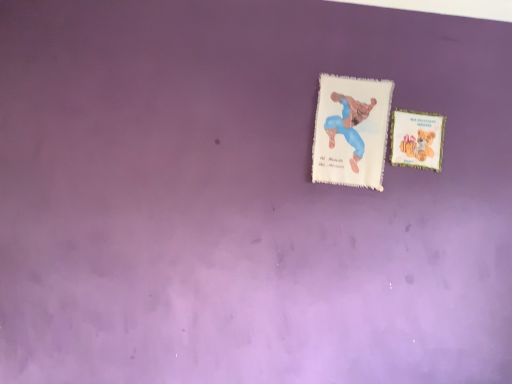
Question: From the image's perspective, is white felt card at upper center, placed as the 2th card when sorted from right to left, located above or below matte paper card at right, which is counted as the 1th card, starting from the right?

Choices:
 (A) below
 (B) above

Answer: (B)

Question: Considering their positions, is white felt card at upper center, placed as the 2th card when sorted from right to left, located in front of or behind matte paper card at right, marked as the 2th card in a left-to-right arrangement?

Choices:
 (A) behind
 (B) front

Answer: (B)

Question: Is point (333, 109) closer or farther from the camera than point (396, 132)?

Choices:
 (A) farther
 (B) closer

Answer: (A)

Question: Based on their sizes in the image, would you say matte paper card at right, which is counted as the 1th card, starting from the right, is bigger or smaller than white felt card at upper center, placed as the 2th card when sorted from right to left?

Choices:
 (A) big
 (B) small

Answer: (B)

Question: Would you say matte paper card at right, which is counted as the 1th card, starting from the right, is to the left or to the right of white felt card at upper center, placed as the 2th card when sorted from right to left, in the picture?

Choices:
 (A) right
 (B) left

Answer: (A)

Question: In the image, is matte paper card at right, which is counted as the 1th card, starting from the right, positioned in front of or behind white felt card at upper center, arranged as the first card when viewed from the left?

Choices:
 (A) front
 (B) behind

Answer: (B)

Question: Is point (398, 125) positioned closer to the camera than point (361, 152)?

Choices:
 (A) closer
 (B) farther

Answer: (B)